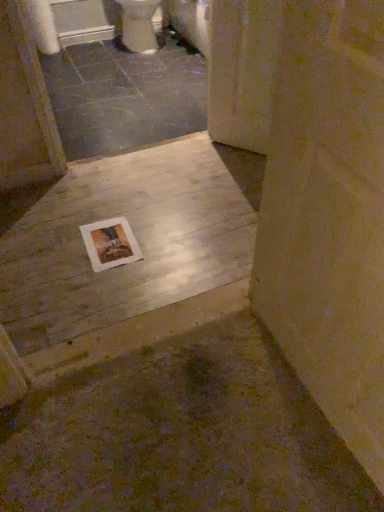
Identify the location of vacant area located to the right-hand side of white paper at upper left. (100, 51).